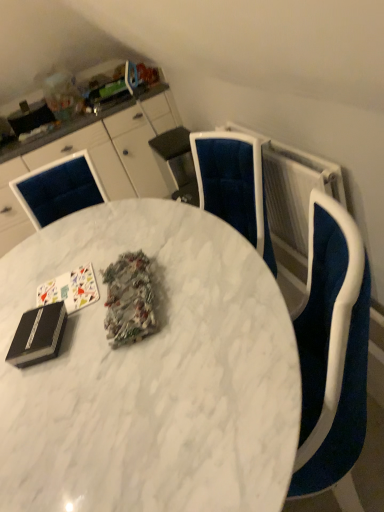
Question: Is white glossy cabinets at upper left located outside black matte binder at lower left?

Choices:
 (A) yes
 (B) no

Answer: (A)

Question: From the image's perspective, would you say white glossy cabinets at upper left is shown under black matte binder at lower left?

Choices:
 (A) no
 (B) yes

Answer: (A)

Question: Is white glossy cabinets at upper left looking in the opposite direction of black matte binder at lower left?

Choices:
 (A) no
 (B) yes

Answer: (A)

Question: From the image's perspective, is white glossy cabinets at upper left over black matte binder at lower left?

Choices:
 (A) no
 (B) yes

Answer: (B)

Question: Can you confirm if white glossy cabinets at upper left is positioned to the right of black matte binder at lower left?

Choices:
 (A) yes
 (B) no

Answer: (B)

Question: Does white glossy cabinets at upper left have a greater height compared to black matte binder at lower left?

Choices:
 (A) no
 (B) yes

Answer: (B)

Question: Considering the relative positions of shiny metallic foil at center and white glossy cabinets at upper left in the image provided, is shiny metallic foil at center to the left of white glossy cabinets at upper left from the viewer's perspective?

Choices:
 (A) yes
 (B) no

Answer: (B)

Question: From the image's perspective, would you say shiny metallic foil at center is shown under white glossy cabinets at upper left?

Choices:
 (A) no
 (B) yes

Answer: (B)

Question: Does shiny metallic foil at center have a lesser height compared to white glossy cabinets at upper left?

Choices:
 (A) yes
 (B) no

Answer: (A)

Question: Considering the relative sizes of shiny metallic foil at center and white glossy cabinets at upper left in the image provided, is shiny metallic foil at center wider than white glossy cabinets at upper left?

Choices:
 (A) no
 (B) yes

Answer: (A)

Question: Considering the relative sizes of shiny metallic foil at center and white glossy cabinets at upper left in the image provided, is shiny metallic foil at center bigger than white glossy cabinets at upper left?

Choices:
 (A) yes
 (B) no

Answer: (B)

Question: Could you tell me if shiny metallic foil at center is facing white glossy cabinets at upper left?

Choices:
 (A) no
 (B) yes

Answer: (A)

Question: Does white matte card game at upper left have a lesser width compared to white glossy cabinets at upper left?

Choices:
 (A) yes
 (B) no

Answer: (A)